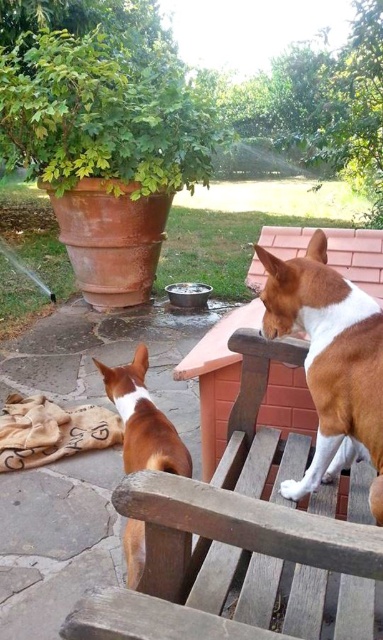
Which is above, brown smooth dog at upper right or brown matte dog at lower left?

brown smooth dog at upper right

Can you confirm if brown smooth dog at upper right is shorter than brown matte dog at lower left?

Indeed, brown smooth dog at upper right has a lesser height compared to brown matte dog at lower left.

Locate an element on the screen. The width and height of the screenshot is (383, 640). brown smooth dog at upper right is located at coordinates (330, 362).

This screenshot has height=640, width=383. Find the location of `brown smooth dog at upper right`. brown smooth dog at upper right is located at coordinates (330, 362).

Does wooden park bench at lower left come in front of brown matte dog at lower left?

Yes, it is.

Identify the location of wooden park bench at lower left. The height and width of the screenshot is (640, 383). (242, 538).

Who is shorter, wooden park bench at lower left or brown smooth dog at upper right?

Standing shorter between the two is wooden park bench at lower left.

Which is below, wooden park bench at lower left or brown smooth dog at upper right?

Positioned lower is wooden park bench at lower left.

Between point (265, 460) and point (351, 369), which one is positioned in front?

Positioned in front is point (351, 369).

Where is `wooden park bench at lower left`? wooden park bench at lower left is located at coordinates (242, 538).